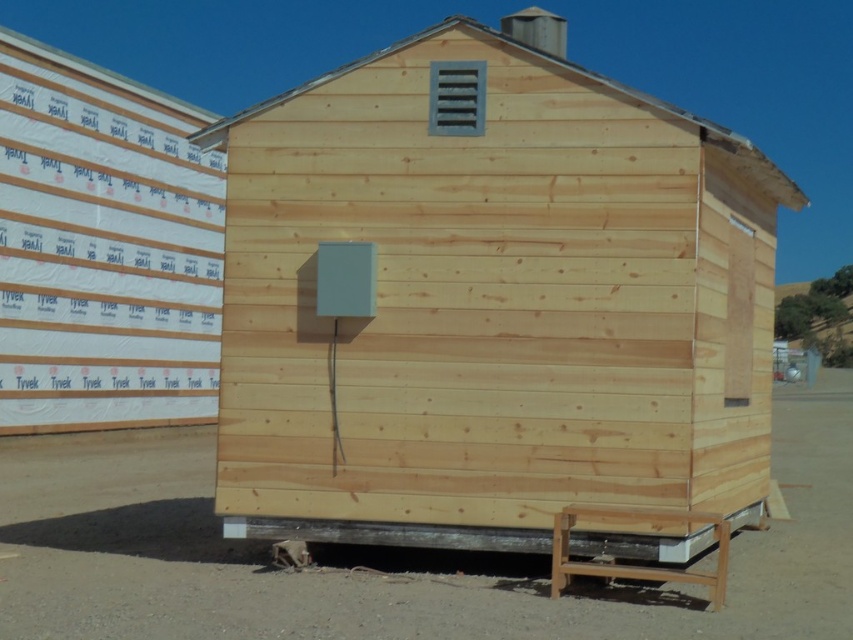
Does natural wood cabin at center have a larger size compared to dirt field at lower center?

No, natural wood cabin at center is not bigger than dirt field at lower center.

Does natural wood cabin at center have a smaller size compared to dirt field at lower center?

Correct, natural wood cabin at center occupies less space than dirt field at lower center.

Describe the element at coordinates (489, 300) in the screenshot. I see `natural wood cabin at center` at that location.

The image size is (853, 640). In order to click on natural wood cabin at center in this screenshot , I will do `click(489, 300)`.

Which is in front, point (479, 380) or point (96, 67)?

Positioned in front is point (479, 380).

From the picture: Can you confirm if natural wood cabin at center is taller than white tyvek siding at upper left?

Incorrect, natural wood cabin at center's height is not larger of white tyvek siding at upper left's.

Describe the element at coordinates (489, 300) in the screenshot. I see `natural wood cabin at center` at that location.

This screenshot has height=640, width=853. Identify the location of natural wood cabin at center. (489, 300).

Can you confirm if dirt field at lower center is positioned above white tyvek siding at upper left?

Incorrect, dirt field at lower center is not positioned above white tyvek siding at upper left.

What do you see at coordinates (386, 556) in the screenshot?
I see `dirt field at lower center` at bounding box center [386, 556].

Which is in front, point (473, 600) or point (177, 374)?

Positioned in front is point (473, 600).

Identify the location of dirt field at lower center. This screenshot has height=640, width=853. (386, 556).